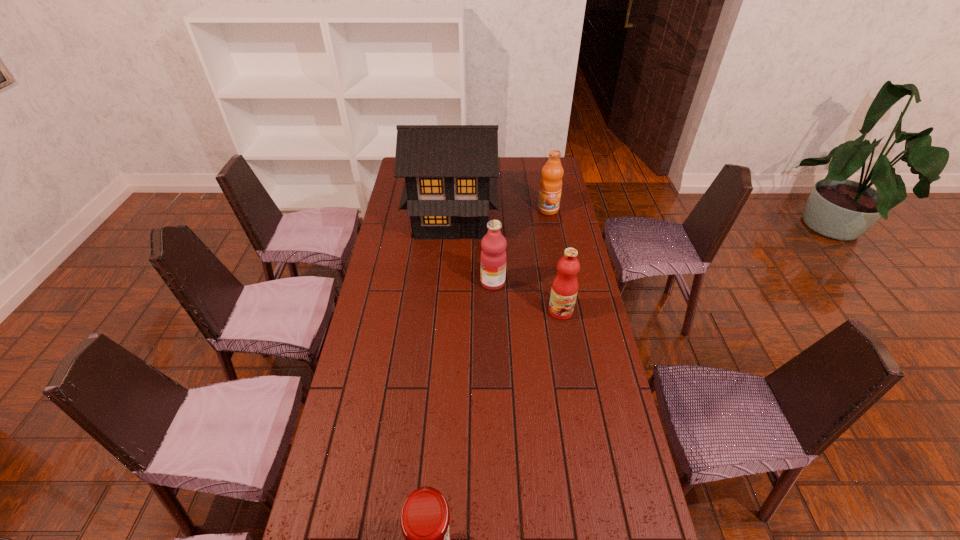
Locate an element on the screen. The width and height of the screenshot is (960, 540). the tallest object is located at coordinates (451, 171).

At what (x,y) coordinates should I click in order to perform the action: click on the farthest fruit juice. Please return your answer as a coordinate pair (x, y). Image resolution: width=960 pixels, height=540 pixels. Looking at the image, I should click on (550, 189).

Locate an element on the screen. The width and height of the screenshot is (960, 540). the nearest fruit juice is located at coordinates (564, 289).

The width and height of the screenshot is (960, 540). Find the location of `the third farthest object`. the third farthest object is located at coordinates (493, 257).

Where is `the second farthest fruit juice`? The width and height of the screenshot is (960, 540). the second farthest fruit juice is located at coordinates (493, 257).

Where is `free space located on the front-facing side of the dollhouse`? This screenshot has height=540, width=960. free space located on the front-facing side of the dollhouse is located at coordinates (444, 315).

You are a GUI agent. You are given a task and a screenshot of the screen. Output one action in this format:
    pyautogui.click(x=<x>, y=<y>)
    Task: Click on the vacant region located on the label side of the farthest fruit juice
    The width and height of the screenshot is (960, 540).
    Given the screenshot: What is the action you would take?
    pyautogui.click(x=555, y=248)

The image size is (960, 540). Find the location of `free space located 0.140m on the front label of the second nearest object`. free space located 0.140m on the front label of the second nearest object is located at coordinates (568, 353).

What are the coordinates of `free location located on the label of the third nearest object` in the screenshot? It's located at (465, 282).

Where is `vacant region located 0.150m on the label of the third nearest object`? vacant region located 0.150m on the label of the third nearest object is located at coordinates (442, 282).